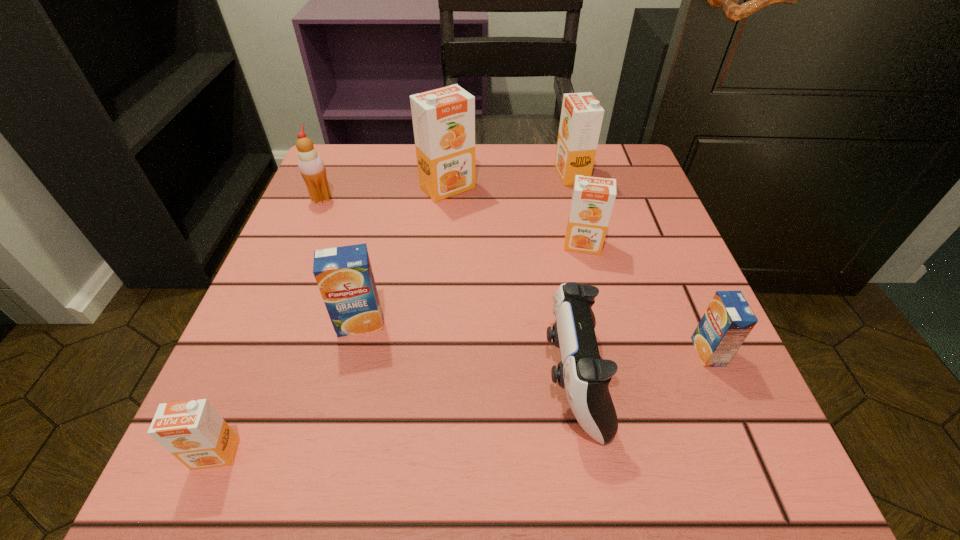
You are a GUI agent. You are given a task and a screenshot of the screen. Output one action in this format:
    pyautogui.click(x=<x>, y=<y>)
    Task: Click on the vacant region at the far edge of the desktop
    
    Given the screenshot: What is the action you would take?
    pyautogui.click(x=479, y=144)

In the image, there is a desktop. Where is `vacant space at the left edge`? The height and width of the screenshot is (540, 960). vacant space at the left edge is located at coordinates (348, 205).

You are a GUI agent. You are given a task and a screenshot of the screen. Output one action in this format:
    pyautogui.click(x=<x>, y=<y>)
    Task: Click on the free spot at the right edge of the desktop
    
    Given the screenshot: What is the action you would take?
    pyautogui.click(x=666, y=335)

In the image, there is a desktop. What are the coordinates of `vacant space at the far left corner` in the screenshot? It's located at (334, 193).

Where is `blank space at the far right corner`? blank space at the far right corner is located at coordinates (644, 181).

This screenshot has width=960, height=540. I want to click on free space between the rightmost object and the icecream, so click(515, 275).

What are the coordinates of `free spot between the right blue orange_juice and the second biggest orange orange juice` in the screenshot? It's located at (639, 263).

Image resolution: width=960 pixels, height=540 pixels. Find the location of `vacant region between the third farthest orange_juice and the sixth object from right to left`. vacant region between the third farthest orange_juice and the sixth object from right to left is located at coordinates (471, 284).

The width and height of the screenshot is (960, 540). In order to click on free space between the fifth nearest object and the tallest orange_juice in this screenshot , I will do `click(516, 216)`.

Where is `unoccupied position between the second tallest orange_juice and the second orange orange juice from left to right`? The image size is (960, 540). unoccupied position between the second tallest orange_juice and the second orange orange juice from left to right is located at coordinates (510, 181).